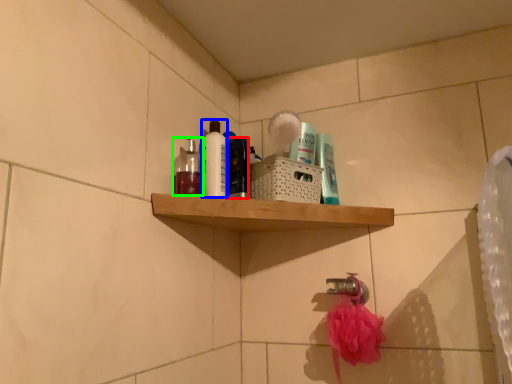
Question: Considering the real-world distances, which object is farthest from toiletry (highlighted by a red box)? cleaning product (highlighted by a blue box) or mouthwash (highlighted by a green box)?

Choices:
 (A) cleaning product
 (B) mouthwash

Answer: (B)